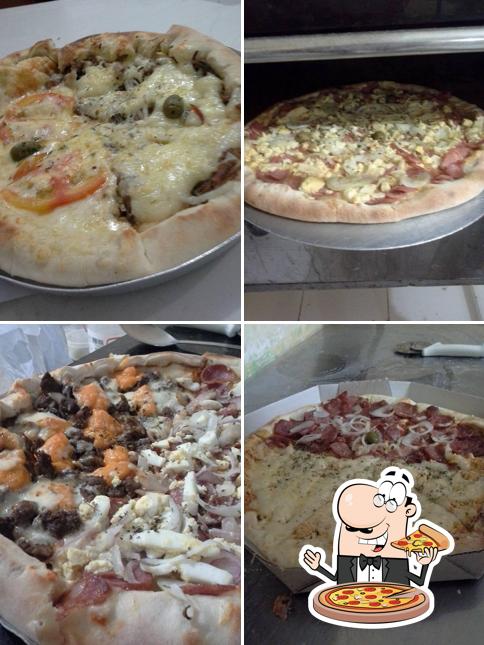
What are the coordinates of `spoon at the top of the third image at the bottom-left side` in the screenshot? It's located at (152, 335).